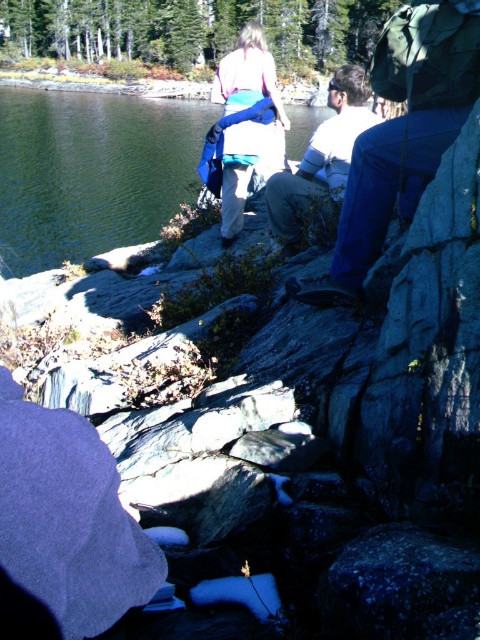
Is blue denim jeans at right shorter than white cotton shirt at center?

Yes.

Does blue denim jeans at right lie behind white cotton shirt at center?

No, it is in front of white cotton shirt at center.

Who is more forward, (419, 12) or (342, 195)?

Point (419, 12)

You are a GUI agent. You are given a task and a screenshot of the screen. Output one action in this format:
    pyautogui.click(x=<x>, y=<y>)
    Task: Click on the blue denim jeans at right
    The width and height of the screenshot is (480, 640).
    Given the screenshot: What is the action you would take?
    pyautogui.click(x=403, y=132)

Is green liquid water at left taller than matte blue backpack at center?

Correct, green liquid water at left is much taller as matte blue backpack at center.

Does green liquid water at left appear on the left side of matte blue backpack at center?

Indeed, green liquid water at left is positioned on the left side of matte blue backpack at center.

Describe the element at coordinates (92, 172) in the screenshot. The image size is (480, 640). I see `green liquid water at left` at that location.

I want to click on green liquid water at left, so click(92, 172).

Is green liquid water at left positioned before blue denim jeans at right?

No.

Can you confirm if green liquid water at left is positioned to the right of blue denim jeans at right?

In fact, green liquid water at left is to the left of blue denim jeans at right.

Describe the element at coordinates (92, 172) in the screenshot. I see `green liquid water at left` at that location.

What are the coordinates of `green liquid water at left` in the screenshot? It's located at (92, 172).